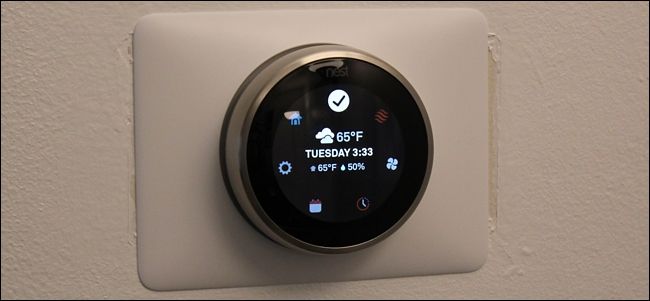
I want to click on calendar, so click(314, 206).